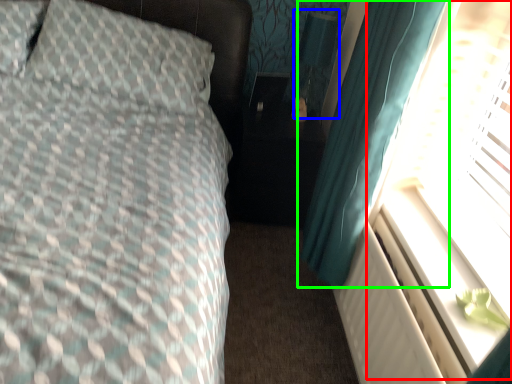
Question: Which object is positioned farthest from window screen (highlighted by a red box)? Select from table lamp (highlighted by a blue box) and curtain (highlighted by a green box).

Choices:
 (A) table lamp
 (B) curtain

Answer: (A)